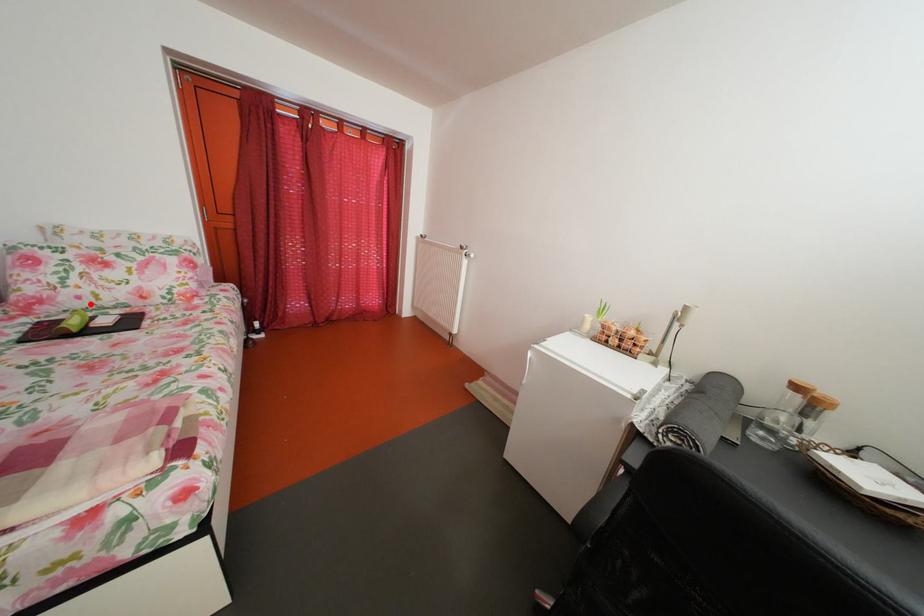
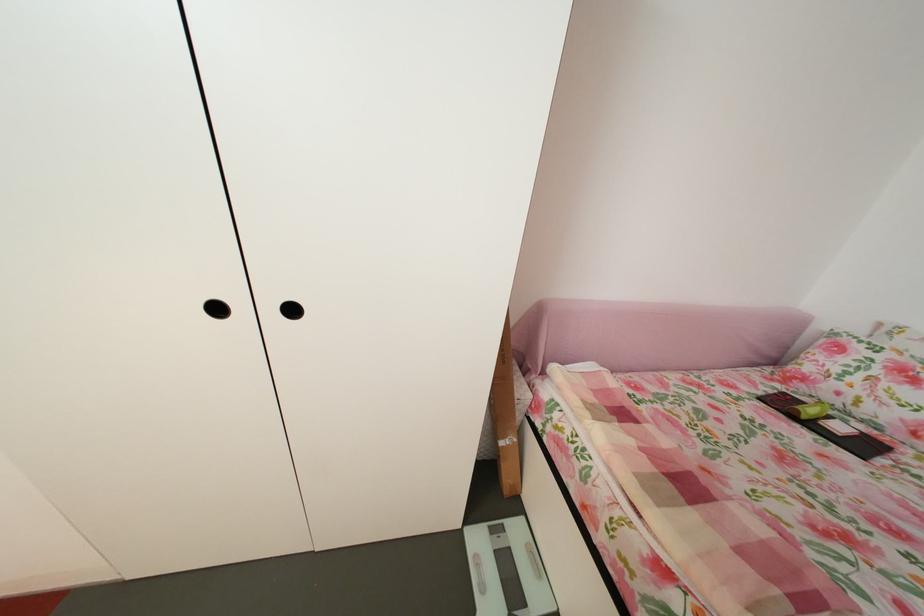
Question: A red point is marked in image1. In image2, is the corresponding 3D point closer to the camera or farther? Reply with the corresponding letter.

Choices:
 (A) The corresponding 3D point is closer.
 (B) The corresponding 3D point is farther.

Answer: (B)